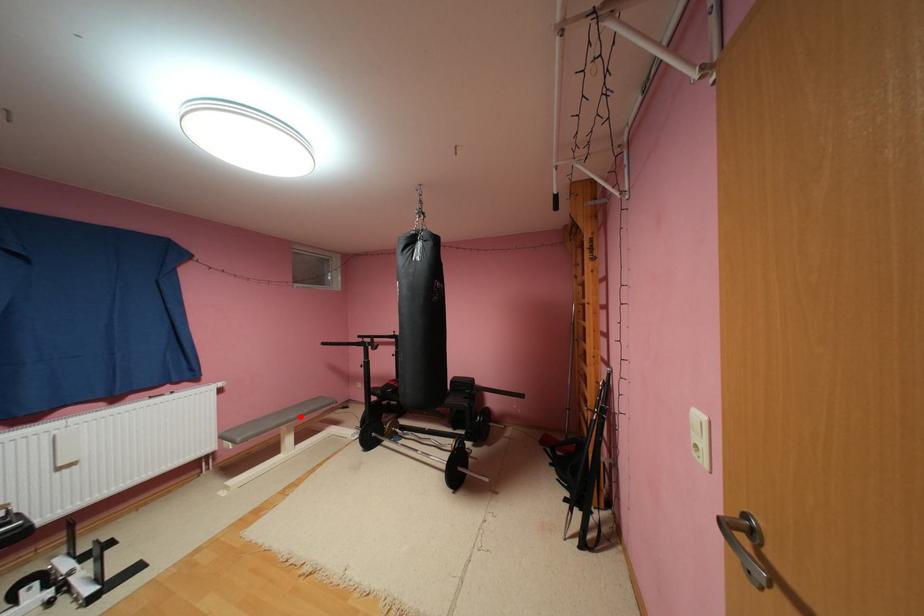
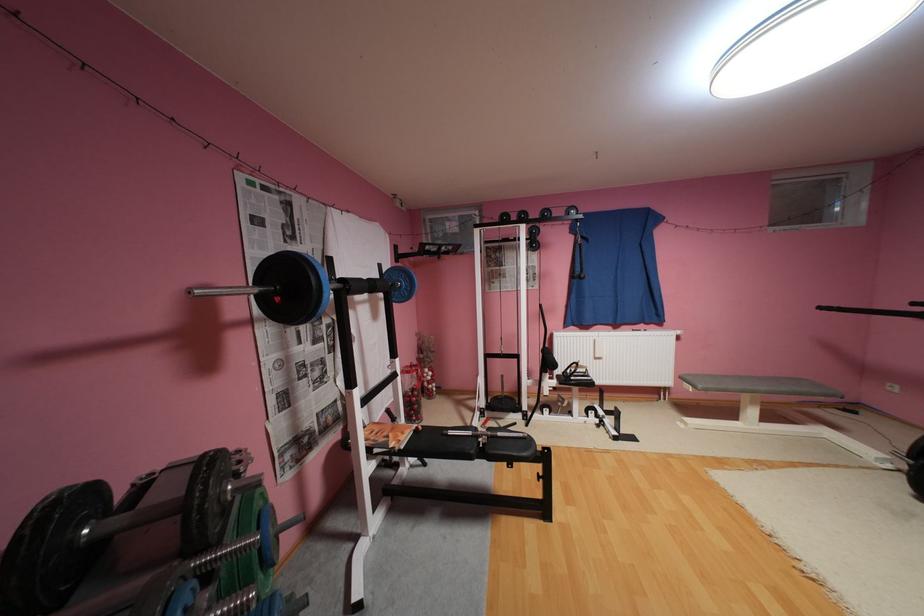
Locate, in the second image, the point that corresponds to the highlighted location in the first image.

(771, 387)